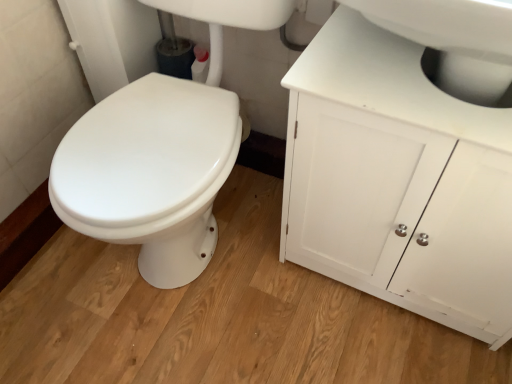
Question: From the image's perspective, is white glossy sink at upper right positioned above or below white matte cabinet at upper right?

Choices:
 (A) below
 (B) above

Answer: (B)

Question: Relative to white matte cabinet at upper right, is white glossy sink at upper right in front or behind?

Choices:
 (A) front
 (B) behind

Answer: (A)

Question: Considering the positions of point (421, 13) and point (393, 167), is point (421, 13) closer or farther from the camera than point (393, 167)?

Choices:
 (A) closer
 (B) farther

Answer: (A)

Question: Looking at their shapes, would you say white matte cabinet at upper right is wider or thinner than white glossy sink at upper right?

Choices:
 (A) wide
 (B) thin

Answer: (B)

Question: From the image's perspective, is white matte cabinet at upper right positioned above or below white glossy sink at upper right?

Choices:
 (A) above
 (B) below

Answer: (B)

Question: Is white matte cabinet at upper right spatially inside white glossy sink at upper right, or outside of it?

Choices:
 (A) outside
 (B) inside

Answer: (A)

Question: In terms of height, does white matte cabinet at upper right look taller or shorter compared to white glossy sink at upper right?

Choices:
 (A) tall
 (B) short

Answer: (A)